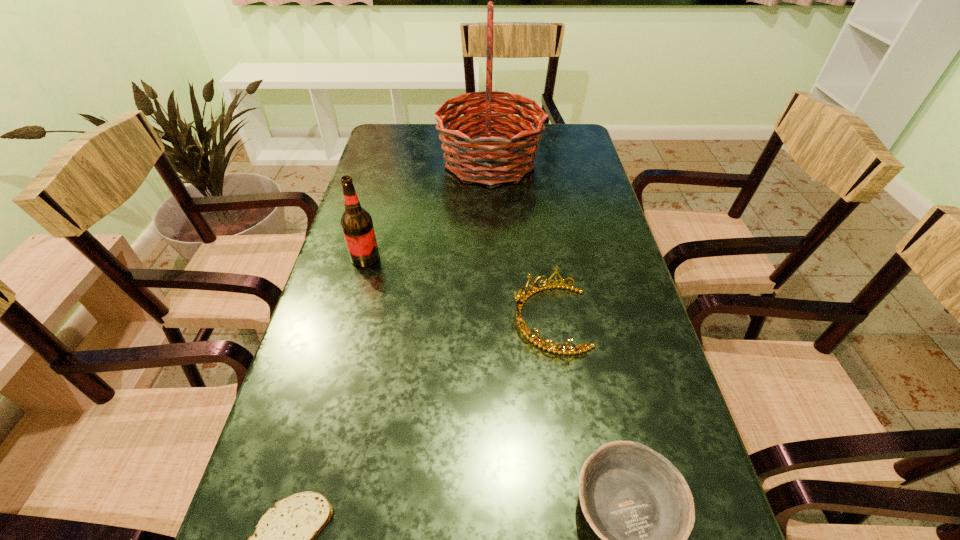
You are a GUI agent. You are given a task and a screenshot of the screen. Output one action in this format:
    pyautogui.click(x=<x>, y=<y>)
    Task: Click on the vacant space located 0.170m on the front-facing side of the third farthest object
    The image size is (960, 540).
    Given the screenshot: What is the action you would take?
    pyautogui.click(x=437, y=319)

The image size is (960, 540). Identify the location of vacant region located 0.290m on the front-facing side of the third farthest object. (383, 319).

Locate an element on the screen. The height and width of the screenshot is (540, 960). free region located 0.240m on the front-facing side of the third farthest object is located at coordinates (405, 319).

At what (x,y) coordinates should I click in order to perform the action: click on object located at the far edge. Please return your answer as a coordinate pair (x, y). Looking at the image, I should click on (498, 159).

This screenshot has height=540, width=960. What are the coordinates of `object situated at the left edge` in the screenshot? It's located at (356, 223).

The image size is (960, 540). I want to click on basket that is at the right edge, so click(498, 159).

At what (x,y) coordinates should I click in order to perform the action: click on tiara positioned at the right edge. Please return your answer as a coordinate pair (x, y). The height and width of the screenshot is (540, 960). Looking at the image, I should click on pos(519,304).

Locate an element on the screen. object that is at the far right corner is located at coordinates (498, 159).

Identify the location of vacant space at the far edge of the desktop. (436, 124).

Locate an element on the screen. Image resolution: width=960 pixels, height=540 pixels. vacant space at the left edge of the desktop is located at coordinates (325, 446).